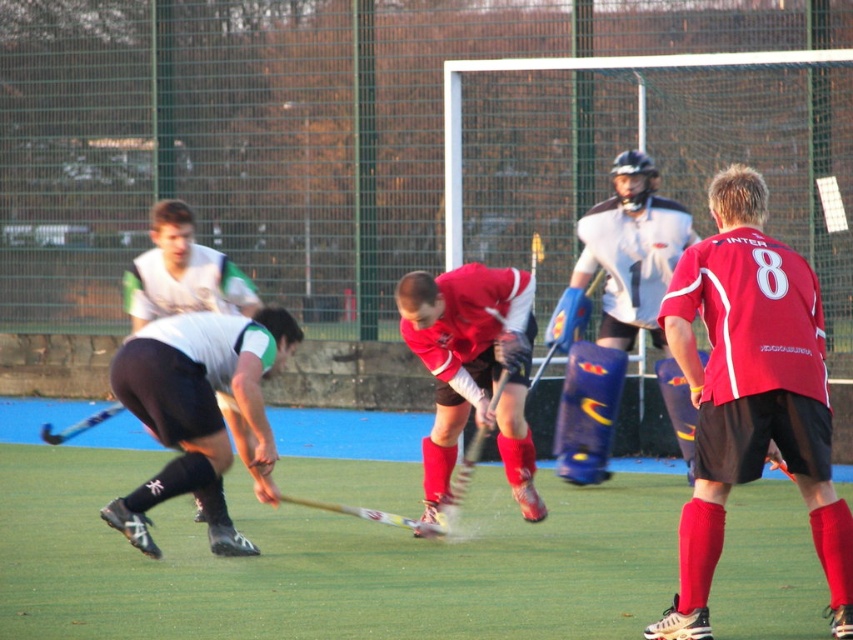
Is matte red shorts at right closer to the viewer compared to blue metallic hockey stick at lower left?

Yes, it is in front of blue metallic hockey stick at lower left.

Is matte red shorts at right above blue metallic hockey stick at lower left?

Indeed, matte red shorts at right is positioned over blue metallic hockey stick at lower left.

What do you see at coordinates (750, 394) in the screenshot?
I see `matte red shorts at right` at bounding box center [750, 394].

At what (x,y) coordinates should I click in order to perform the action: click on matte red shorts at right. Please return your answer as a coordinate pair (x, y). The height and width of the screenshot is (640, 853). Looking at the image, I should click on (750, 394).

Between matte white shorts at left and matte red hockey stick at center, which one is positioned lower?

matte white shorts at left is below.

How much distance is there between matte white shorts at left and matte red hockey stick at center?

3.64 feet

At what (x,y) coordinates should I click in order to perform the action: click on matte white shorts at left. Please return your answer as a coordinate pair (x, y). The width and height of the screenshot is (853, 640). Looking at the image, I should click on [x=200, y=413].

Does matte red hockey stick at center appear on the left side of blue metallic hockey stick at lower left?

In fact, matte red hockey stick at center is to the right of blue metallic hockey stick at lower left.

Which is above, matte red hockey stick at center or blue metallic hockey stick at lower left?

Positioned higher is matte red hockey stick at center.

Which is behind, point (503, 348) or point (73, 429)?

The point (73, 429) is behind.

The width and height of the screenshot is (853, 640). Find the location of `matte red hockey stick at center`. matte red hockey stick at center is located at coordinates (473, 369).